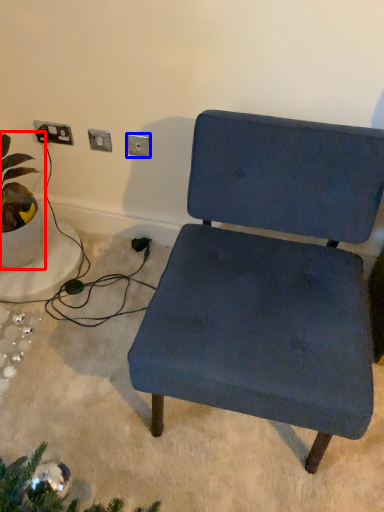
Question: Which point is closer to the camera, houseplant (highlighted by a red box) or electric outlet (highlighted by a blue box)?

Choices:
 (A) houseplant
 (B) electric outlet

Answer: (A)